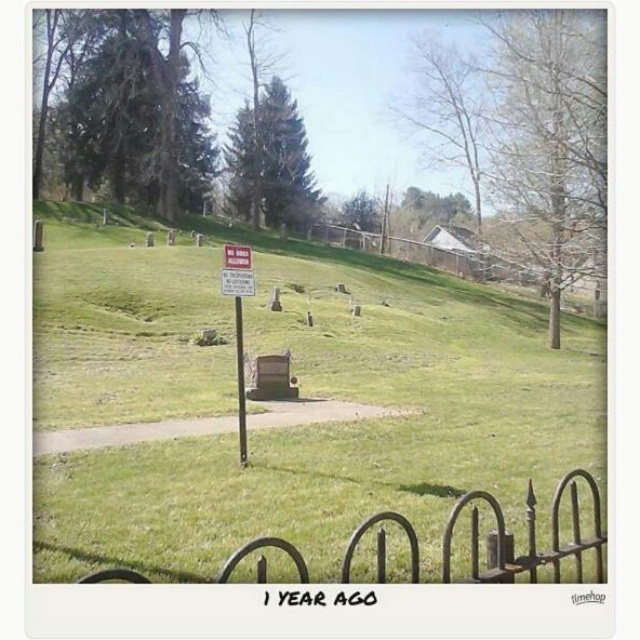
Based on the scene described, what is located at the coordinates point (301, 413)?

The coordinates point (301, 413) is occupied by green grassy at center.